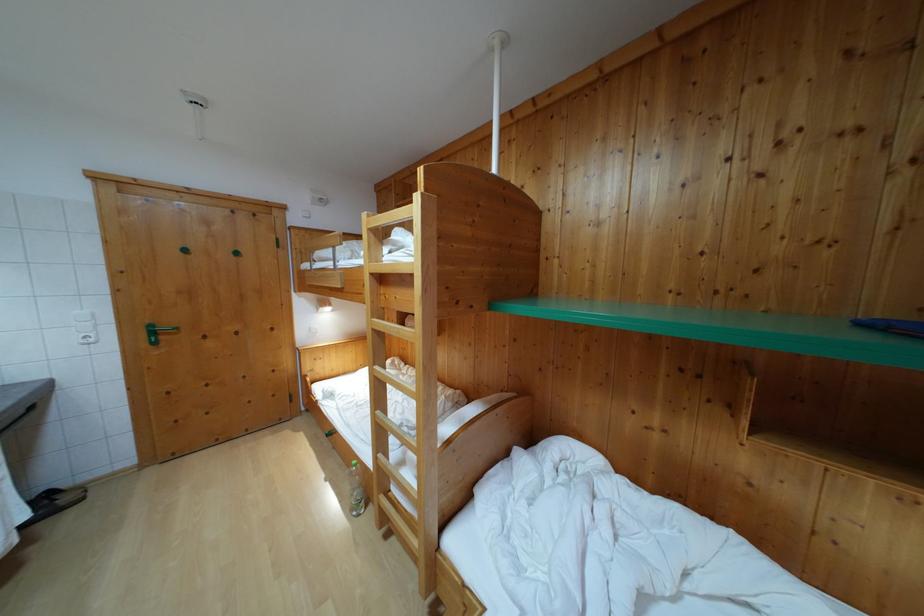
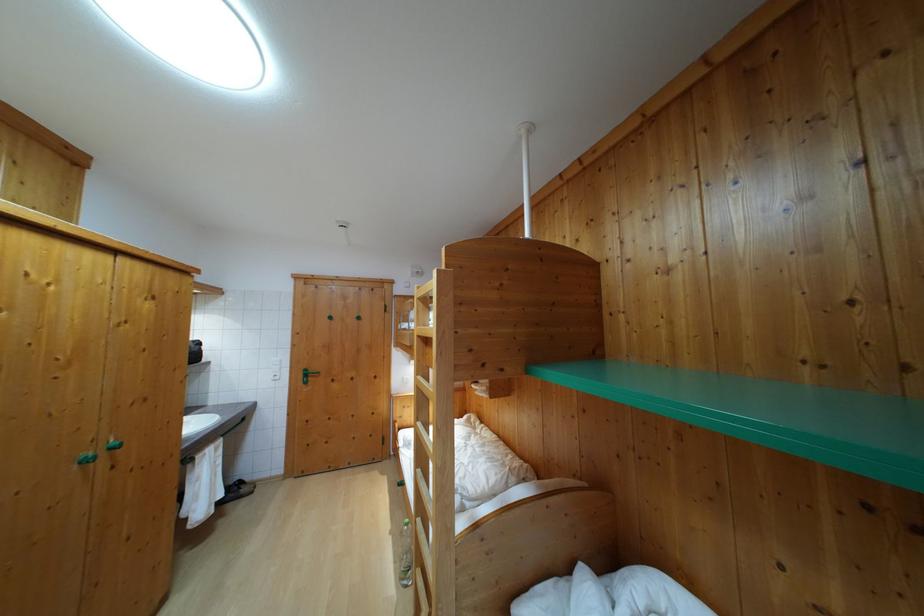
Question: The images are taken continuously from a first-person perspective. In which direction are you moving?

Choices:
 (A) Left
 (B) Right
 (C) Forward
 (D) Backward

Answer: (B)